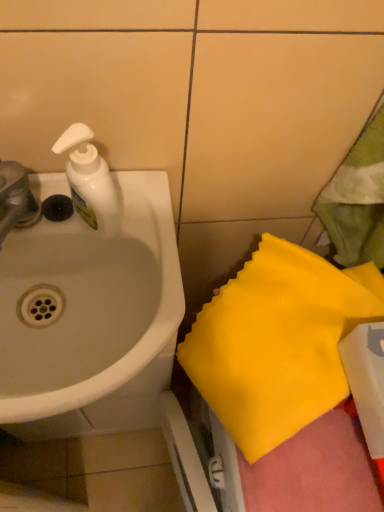
Question: Can you confirm if white glossy sink at left is wider than yellow fabric at lower right?

Choices:
 (A) yes
 (B) no

Answer: (A)

Question: Are white glossy sink at left and yellow fabric at lower right far apart?

Choices:
 (A) yes
 (B) no

Answer: (B)

Question: Is white glossy sink at left with yellow fabric at lower right?

Choices:
 (A) no
 (B) yes

Answer: (A)

Question: Can we say white glossy sink at left lies outside yellow fabric at lower right?

Choices:
 (A) no
 (B) yes

Answer: (B)

Question: Does white glossy sink at left appear on the right side of yellow fabric at lower right?

Choices:
 (A) no
 (B) yes

Answer: (A)

Question: Is white glossy sink at left taller or shorter than white plastic soap dispenser at upper left?

Choices:
 (A) tall
 (B) short

Answer: (B)

Question: Is white glossy sink at left situated inside white plastic soap dispenser at upper left or outside?

Choices:
 (A) outside
 (B) inside

Answer: (A)

Question: In the image, is white glossy sink at left on the left side or the right side of white plastic soap dispenser at upper left?

Choices:
 (A) right
 (B) left

Answer: (B)

Question: Looking at their shapes, would you say white glossy sink at left is wider or thinner than white plastic soap dispenser at upper left?

Choices:
 (A) thin
 (B) wide

Answer: (B)

Question: From a real-world perspective, is yellow fabric at lower right positioned above or below metallic silver faucet at left?

Choices:
 (A) above
 (B) below

Answer: (B)

Question: Does point (307, 257) appear closer or farther from the camera than point (6, 188)?

Choices:
 (A) farther
 (B) closer

Answer: (A)

Question: Looking at their shapes, would you say yellow fabric at lower right is wider or thinner than metallic silver faucet at left?

Choices:
 (A) thin
 (B) wide

Answer: (B)

Question: Relative to metallic silver faucet at left, is yellow fabric at lower right in front or behind?

Choices:
 (A) front
 (B) behind

Answer: (A)

Question: From a real-world perspective, is white plastic soap dispenser at upper left positioned above or below metallic silver faucet at left?

Choices:
 (A) above
 (B) below

Answer: (A)

Question: From the image's perspective, is white plastic soap dispenser at upper left above or below metallic silver faucet at left?

Choices:
 (A) below
 (B) above

Answer: (B)